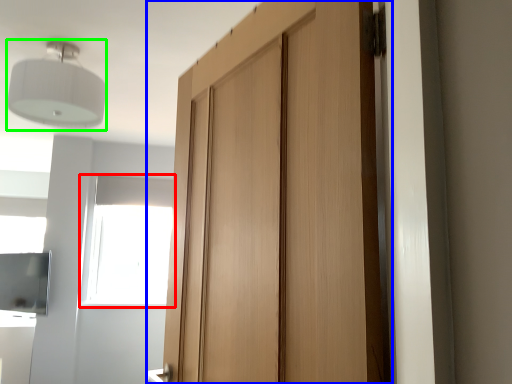
Question: Which is farther away from window (highlighted by a red box)? door (highlighted by a blue box) or light fixture (highlighted by a green box)?

Choices:
 (A) door
 (B) light fixture

Answer: (A)